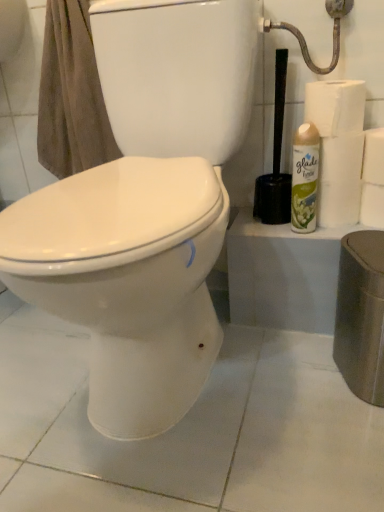
Question: Is white paper at right, the first toilet paper from the bottom, thinner than white paper towel at right, the 3th toilet paper in the top-to-bottom sequence?

Choices:
 (A) no
 (B) yes

Answer: (A)

Question: Is white paper at right, placed as the 4th toilet paper when sorted from top to bottom, at the right side of white paper towel at right, the 3th toilet paper in the top-to-bottom sequence?

Choices:
 (A) yes
 (B) no

Answer: (A)

Question: Is white paper at right, placed as the 4th toilet paper when sorted from top to bottom, in contact with white paper towel at right, marked as the 2th toilet paper in a bottom-to-top arrangement?

Choices:
 (A) no
 (B) yes

Answer: (B)

Question: Considering the relative sizes of white paper at right, placed as the 4th toilet paper when sorted from top to bottom, and white paper towel at right, the 3th toilet paper in the top-to-bottom sequence, in the image provided, is white paper at right, placed as the 4th toilet paper when sorted from top to bottom, smaller than white paper towel at right, the 3th toilet paper in the top-to-bottom sequence,?

Choices:
 (A) yes
 (B) no

Answer: (A)

Question: Is white paper at right, the first toilet paper from the bottom, facing towards white paper towel at right, the 3th toilet paper in the top-to-bottom sequence?

Choices:
 (A) no
 (B) yes

Answer: (A)

Question: Is white paper at right, the second toilet paper from the top, to the left or to the right of brown cotton towel at upper left in the image?

Choices:
 (A) left
 (B) right

Answer: (B)

Question: In terms of height, does white paper at right, the second toilet paper from the top, look taller or shorter compared to brown cotton towel at upper left?

Choices:
 (A) tall
 (B) short

Answer: (B)

Question: From a real-world perspective, is white paper at right, the second toilet paper from the top, physically located above or below brown cotton towel at upper left?

Choices:
 (A) below
 (B) above

Answer: (A)

Question: Considering the positions of white paper at right, marked as the third toilet paper in a bottom-to-top arrangement, and brown cotton towel at upper left in the image, is white paper at right, marked as the third toilet paper in a bottom-to-top arrangement, bigger or smaller than brown cotton towel at upper left?

Choices:
 (A) big
 (B) small

Answer: (B)

Question: Considering the positions of green matte air freshener at right and white paper at right, placed as the 4th toilet paper when sorted from top to bottom, in the image, is green matte air freshener at right taller or shorter than white paper at right, placed as the 4th toilet paper when sorted from top to bottom,?

Choices:
 (A) short
 (B) tall

Answer: (B)

Question: Is green matte air freshener at right situated inside white paper at right, the first toilet paper from the bottom, or outside?

Choices:
 (A) inside
 (B) outside

Answer: (B)

Question: Based on their sizes in the image, would you say green matte air freshener at right is bigger or smaller than white paper at right, placed as the 4th toilet paper when sorted from top to bottom?

Choices:
 (A) big
 (B) small

Answer: (B)

Question: Visually, is green matte air freshener at right positioned to the left or to the right of white paper at right, the first toilet paper from the bottom?

Choices:
 (A) right
 (B) left

Answer: (B)

Question: Considering their positions, is brown cotton towel at upper left located in front of or behind white paper towel at right, the 3th toilet paper in the top-to-bottom sequence?

Choices:
 (A) behind
 (B) front

Answer: (B)

Question: From the image's perspective, is brown cotton towel at upper left positioned above or below white paper towel at right, the 3th toilet paper in the top-to-bottom sequence?

Choices:
 (A) below
 (B) above

Answer: (B)